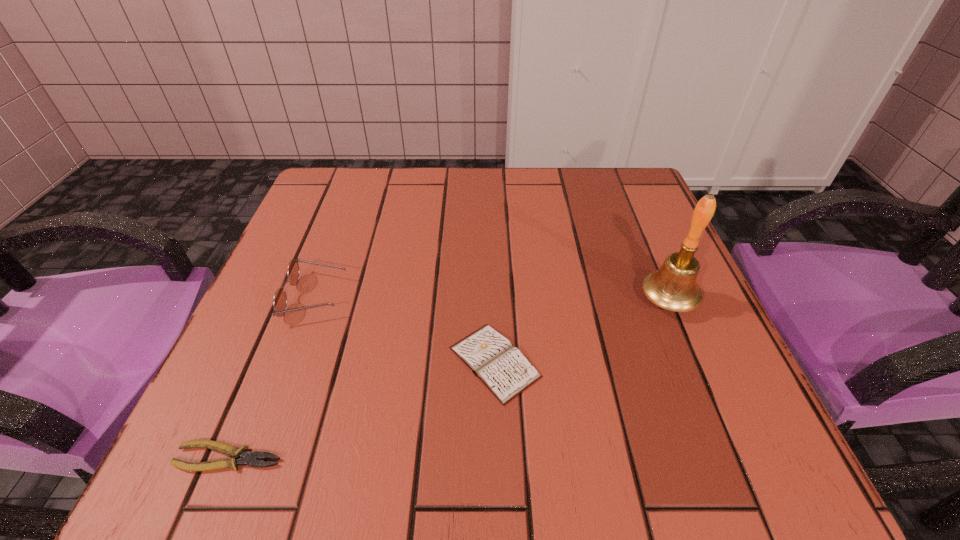
Locate an element on the screen. free space at the far left corner of the desktop is located at coordinates (355, 210).

What are the coordinates of `free location at the near left corner` in the screenshot? It's located at (261, 443).

Locate an element on the screen. vacant space at the near right corner is located at coordinates (738, 419).

The height and width of the screenshot is (540, 960). I want to click on free space between the bell and the spectacles, so click(492, 299).

Image resolution: width=960 pixels, height=540 pixels. In order to click on unoccupied area between the rightmost object and the second tallest object in this screenshot , I will do `click(492, 299)`.

Locate an element on the screen. The image size is (960, 540). free space between the spectacles and the shortest object is located at coordinates (273, 377).

The height and width of the screenshot is (540, 960). What are the coordinates of `free area in between the rightmost object and the shortest object` in the screenshot? It's located at (448, 379).

In order to click on vacant space that is in between the pliers and the tallest object in this screenshot , I will do `click(448, 379)`.

Image resolution: width=960 pixels, height=540 pixels. I want to click on vacant region between the rightmost object and the shortest object, so click(448, 379).

The image size is (960, 540). Identify the location of vacant point located between the pliers and the second tallest object. (273, 377).